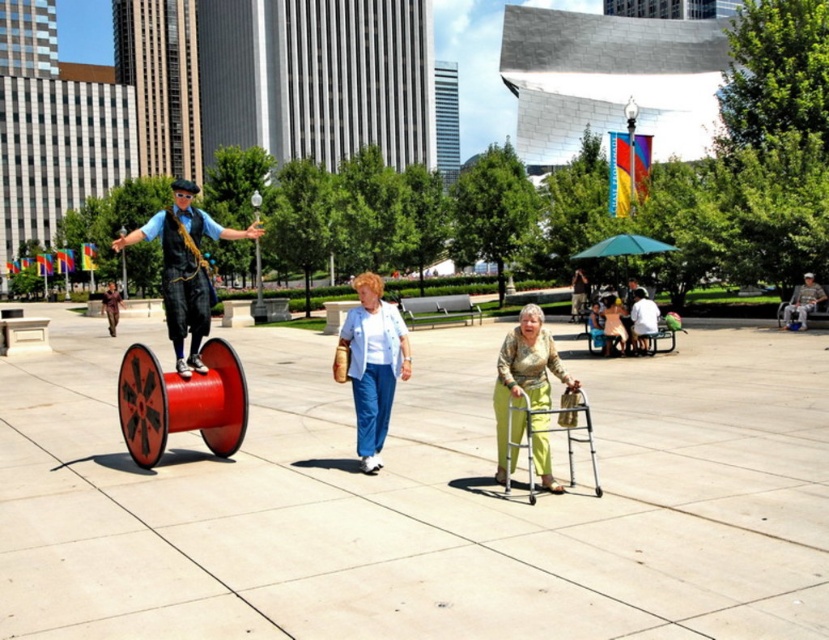
You are standing in the urban park and want to know which of the two points, point (x=199, y=332) or point (x=526, y=444), is closer to you. Can you determine this based on their positions?

Point (x=199, y=332) is closer to you than point (x=526, y=444) because it is further to the viewer.

You are a fashion designer observing the urban park scene. You notice the matte white blouse at center and the green textured pants at center. Which clothing item appears to be smaller in size?

The matte white blouse at center has a smaller size compared to the green textured pants at center.